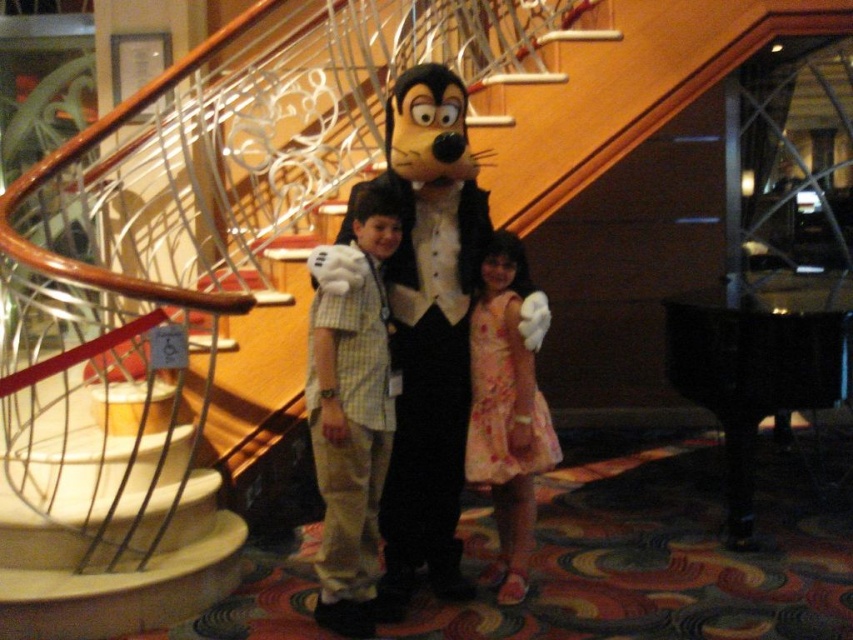
You are a fashion designer observing the image. You need to decide which clothing item, the light brown cotton pants at center or the floral cotton dress at center, would be more suitable for a child who requires comfortable and durable clothing for outdoor activities. Based on their sizes, which would you recommend?

The light brown cotton pants at center is larger in size than the floral cotton dress at center, making it more suitable for a child needing comfortable and durable clothing for outdoor activities.

You are standing in the grand setting and want to take a photo with the white plush mascot at center. If your camera has a maximum focus range of 8 feet, will you be able to take a clear photo of the mascot?

The white plush mascot at center is 8.82 feet away from you, which exceeds the camera maximum focus range of 8 feet. Therefore, you will not be able to take a clear photo of the mascot.

You are a photographer trying to capture a photo of the white plush mascot at center and the light brown cotton pants at center. Based on their positions, which one is higher up in the image?

The white plush mascot at center is above light brown cotton pants at center, so it is higher up in the image.